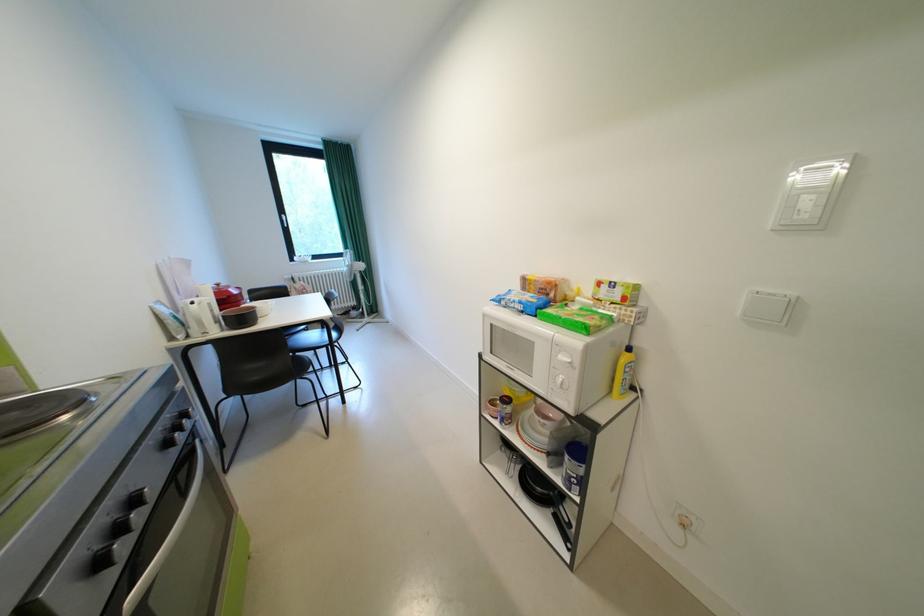
Image resolution: width=924 pixels, height=616 pixels. Identify the location of white light switch. (808, 205).